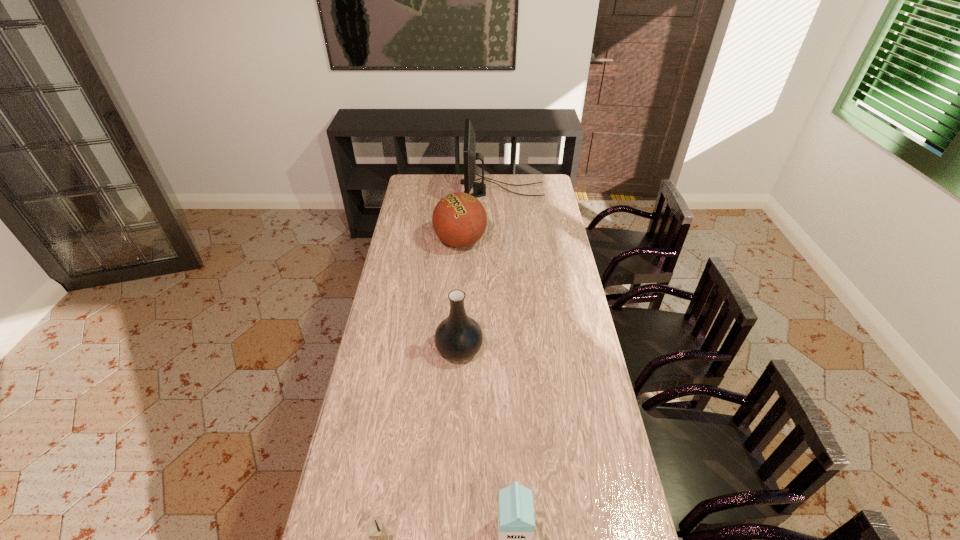
What are the coordinates of `computer monitor` in the screenshot? It's located at (470, 156).

Locate an element on the screen. This screenshot has width=960, height=540. the farthest object is located at coordinates click(x=470, y=156).

This screenshot has width=960, height=540. I want to click on the third nearest object, so click(458, 337).

Image resolution: width=960 pixels, height=540 pixels. Find the location of `the second farthest object`. the second farthest object is located at coordinates point(459,219).

You are a GUI agent. You are given a task and a screenshot of the screen. Output one action in this format:
    pyautogui.click(x=<x>, y=<y>)
    Task: Click on the free space located on the screen side of the computer monitor
    The image size is (960, 540).
    Given the screenshot: What is the action you would take?
    pyautogui.click(x=446, y=191)

I want to click on free point located 0.130m on the screen side of the computer monitor, so click(438, 191).

You are a GUI agent. You are given a task and a screenshot of the screen. Output one action in this format:
    pyautogui.click(x=<x>, y=<y>)
    Task: Click on the vacant space located on the screen side of the computer monitor
    
    Given the screenshot: What is the action you would take?
    pyautogui.click(x=413, y=191)

At what (x,y) coordinates should I click in order to perform the action: click on free location located on the back of the third nearest object. Please return your answer as a coordinate pair (x, y). Looking at the image, I should click on (461, 321).

This screenshot has height=540, width=960. What are the coordinates of `vacant region located on the right of the basketball` in the screenshot? It's located at (556, 242).

This screenshot has height=540, width=960. I want to click on object that is positioned at the far edge, so click(470, 156).